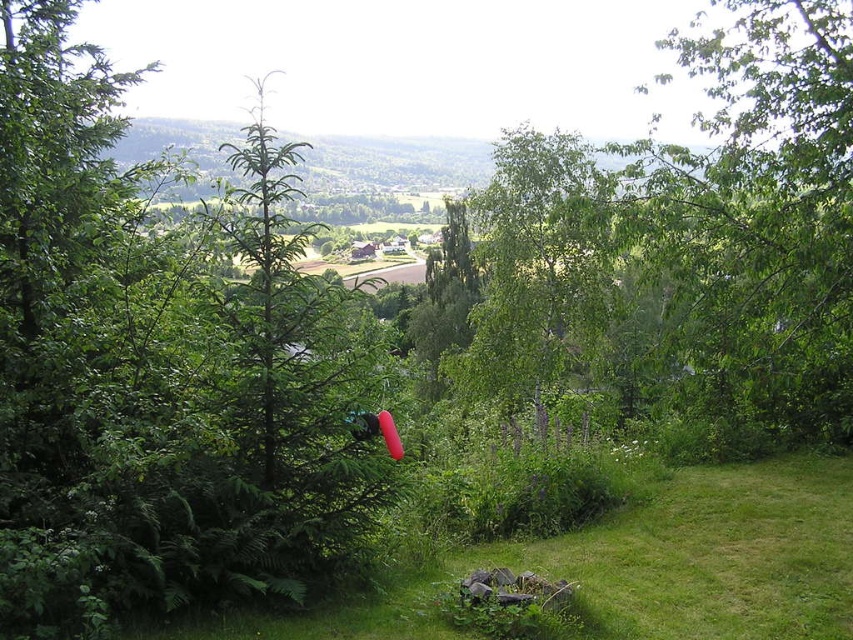
You are standing at the top of a hill overlooking the village. You see the green leafy tree at center and the green grass at lower left. Which object is higher in elevation?

The green leafy tree at center is located above the green grass at lower left, so it is higher in elevation.

You are a hiker standing at the edge of the maintained garden space in the lower part of the frame. You want to take a photo that includes both the green leafy tree at left and the green leafy tree at center. Which tree should you position closer to the camera to ensure both are fully visible in the frame?

To ensure both the green leafy tree at left and the green leafy tree at center are fully visible in the frame, you should position the green leafy tree at center closer to the camera. Since the green leafy tree at left is taller than the green leafy tree at center, placing the shorter tree closer will help balance their sizes in the photo.

You are standing in the lush landscape and want to take a photo of both the green leafy tree at left and the green leafy tree at center. Which tree should you focus on first to ensure both are in clear view?

You should focus on the green leafy tree at left first because it is closer to you than the green leafy tree at center, so adjusting the focus from near to far will help both trees appear clear in the photo.